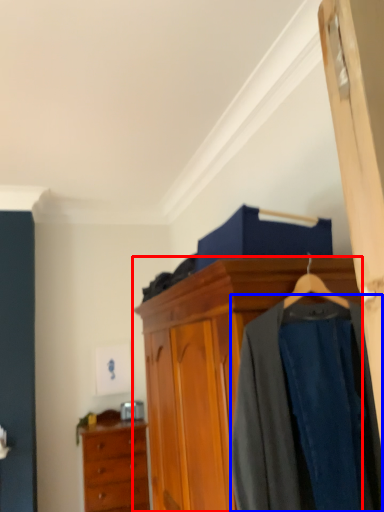
Question: Among these objects, which one is nearest to the camera, cabinetry (highlighted by a red box) or clothing (highlighted by a blue box)?

Choices:
 (A) cabinetry
 (B) clothing

Answer: (A)